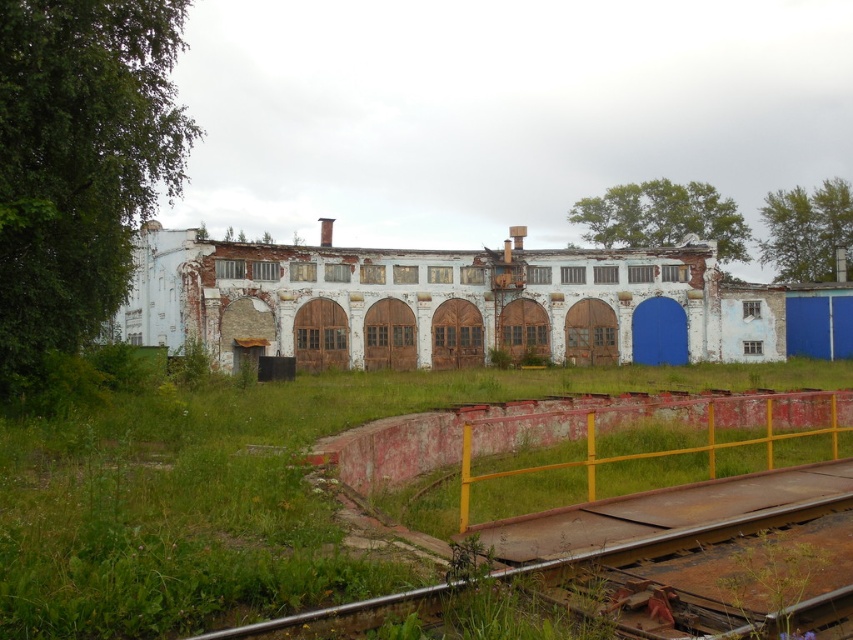
You are standing at the entrance of the old industrial building and want to walk towards the point marked as point (805,566). If you look towards that point, will you see the point marked as point (674,417) behind it?

Yes, because point (674,417) is behind point (805,566).